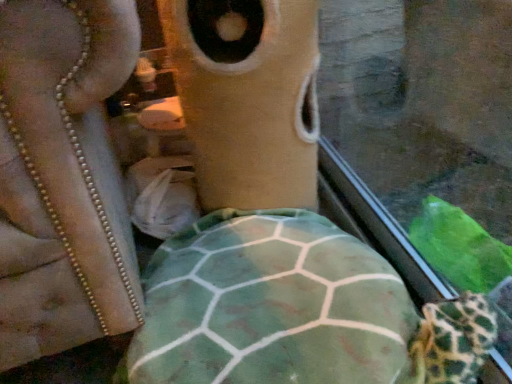
Question: Is green fabric tortoise at center surrounding fuzzy beige cat at center?

Choices:
 (A) yes
 (B) no

Answer: (B)

Question: Is green fabric tortoise at center outside fuzzy beige cat at center?

Choices:
 (A) yes
 (B) no

Answer: (A)

Question: Is green fabric tortoise at center looking in the opposite direction of fuzzy beige cat at center?

Choices:
 (A) yes
 (B) no

Answer: (A)

Question: From the image's perspective, is green fabric tortoise at center over fuzzy beige cat at center?

Choices:
 (A) yes
 (B) no

Answer: (B)

Question: Can you confirm if green fabric tortoise at center is wider than fuzzy beige cat at center?

Choices:
 (A) no
 (B) yes

Answer: (B)

Question: Is green fabric tortoise at center at the right side of fuzzy beige cat at center?

Choices:
 (A) no
 (B) yes

Answer: (A)

Question: From the image's perspective, would you say fuzzy beige cat at center is positioned over green fabric tortoise at center?

Choices:
 (A) no
 (B) yes

Answer: (B)

Question: Is fuzzy beige cat at center not close to green fabric tortoise at center?

Choices:
 (A) no
 (B) yes

Answer: (A)

Question: Would you say green fabric tortoise at center is part of fuzzy beige cat at center's contents?

Choices:
 (A) yes
 (B) no

Answer: (B)

Question: From a real-world perspective, is fuzzy beige cat at center positioned under green fabric tortoise at center based on gravity?

Choices:
 (A) no
 (B) yes

Answer: (A)

Question: Does fuzzy beige cat at center lie in front of green fabric tortoise at center?

Choices:
 (A) yes
 (B) no

Answer: (B)

Question: From a real-world perspective, is fuzzy beige cat at center physically above green fabric tortoise at center?

Choices:
 (A) yes
 (B) no

Answer: (A)

Question: Considering the positions of green fabric tortoise at center and fuzzy beige cat at center in the image, is green fabric tortoise at center taller or shorter than fuzzy beige cat at center?

Choices:
 (A) short
 (B) tall

Answer: (A)